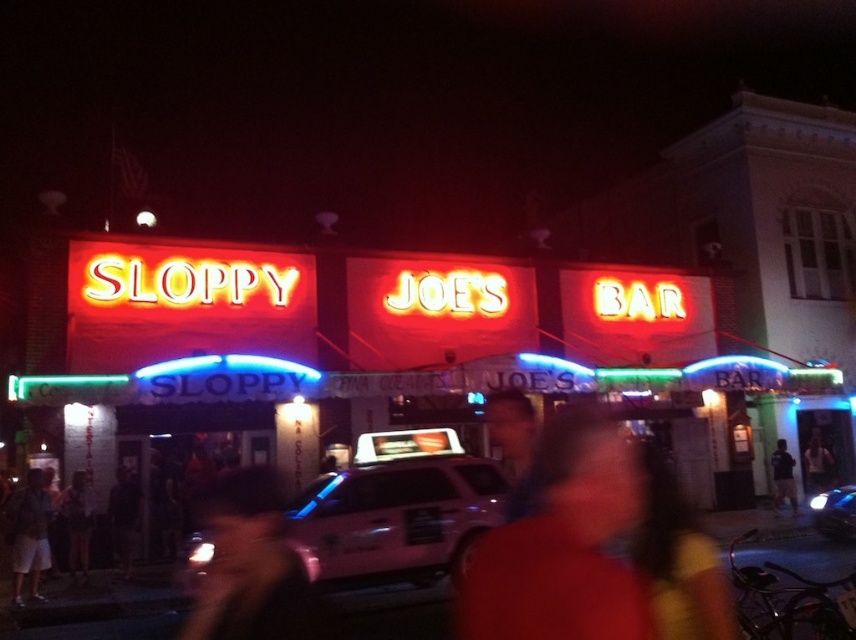
You are a customer entering Sloppy Joe s Bar and notice two items in your view. The shiny black hat at lower left and the dark hair at center. Which item is shorter?

The shiny black hat at lower left is not as tall as the dark hair at center, so the shiny black hat at lower left is shorter.

You are standing at the entrance of Sloppy Joe Bar and want to place a 5 meter long banner between the shiny black hat at lower left and dark hair at center. Is there enough space?

The distance between the shiny black hat at lower left and dark hair at center is 4.48 meters, so the 5 meter long banner would be too long to fit between them. You need a shorter banner.